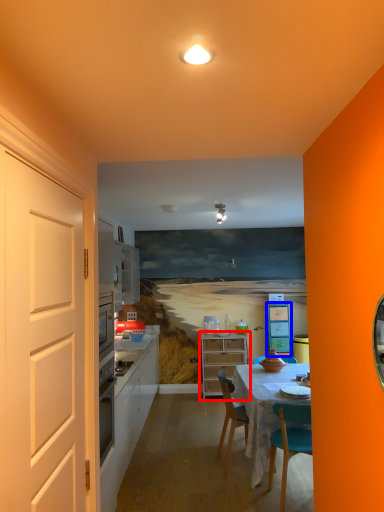
Question: Which of the following is the closest to the observer, cabinetry (highlighted by a red box) or cabinetry (highlighted by a blue box)?

Choices:
 (A) cabinetry
 (B) cabinetry

Answer: (A)